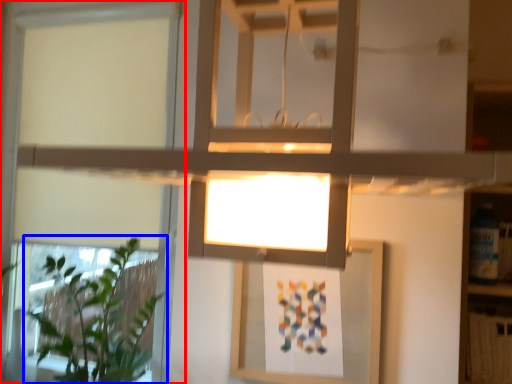
Question: Which object appears closest to the camera in this image, window (highlighted by a red box) or houseplant (highlighted by a blue box)?

Choices:
 (A) window
 (B) houseplant

Answer: (B)